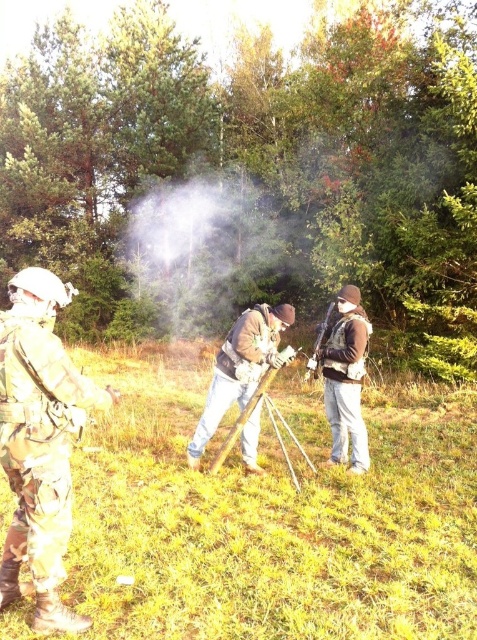
What is the position of the point with coordinates (239,368) in the image?

The point with coordinates (239,368) is located on the brown leather backpack at center.

You are a hiker who wants to set up a tent in the area. Considering the green grassy at center and the wooden tripod at center, which location would you choose for the tent to ensure it is closer to the grassy area?

The green grassy at center is in front of the wooden tripod at center, so placing the tent near the green grassy at center would ensure it is closer to the grassy area.